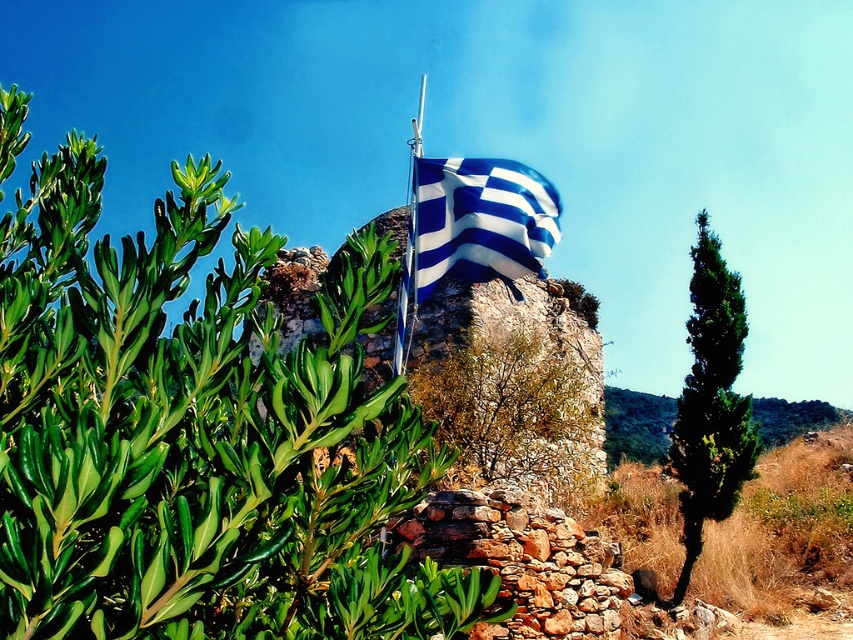
Is green leafy shrub at center to the right of blue and white fabric flag at center from the viewer's perspective?

In fact, green leafy shrub at center is to the left of blue and white fabric flag at center.

Does green leafy shrub at center have a larger size compared to blue and white fabric flag at center?

Indeed, green leafy shrub at center has a larger size compared to blue and white fabric flag at center.

What do you see at coordinates (198, 436) in the screenshot? Image resolution: width=853 pixels, height=640 pixels. I see `green leafy shrub at center` at bounding box center [198, 436].

At what (x,y) coordinates should I click in order to perform the action: click on green leafy shrub at center. Please return your answer as a coordinate pair (x, y). The width and height of the screenshot is (853, 640). Looking at the image, I should click on (198, 436).

Between point (579, 452) and point (407, 269), which one is positioned in front?

Point (407, 269) is more forward.

Can you confirm if brown dry bush at center is smaller than metallic flag pole at center?

Correct, brown dry bush at center occupies less space than metallic flag pole at center.

Identify the location of brown dry bush at center. (515, 406).

Who is shorter, green leafy shrub at center or green coniferous tree at right?

green leafy shrub at center

How much distance is there between green leafy shrub at center and green coniferous tree at right?

green leafy shrub at center and green coniferous tree at right are 38.96 feet apart from each other.

Locate an element on the screen. The image size is (853, 640). green leafy shrub at center is located at coordinates (198, 436).